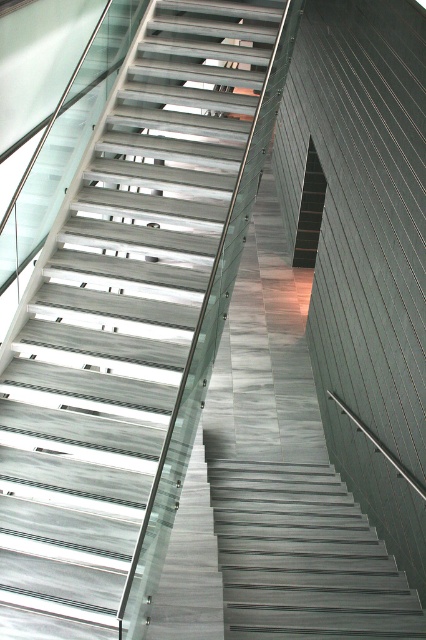
Question: Which point appears closest to the camera in this image?

Choices:
 (A) (310, 160)
 (B) (94, 188)

Answer: (B)

Question: Which of the following is the closest to the observer?

Choices:
 (A) (100, 352)
 (B) (302, 218)

Answer: (A)

Question: Is metallic gray stairs at center to the left of black matte stair at center from the viewer's perspective?

Choices:
 (A) no
 (B) yes

Answer: (B)

Question: Is metallic gray stairs at center bigger than black matte stair at center?

Choices:
 (A) yes
 (B) no

Answer: (B)

Question: Is metallic gray stairs at center positioned before black matte stair at center?

Choices:
 (A) yes
 (B) no

Answer: (A)